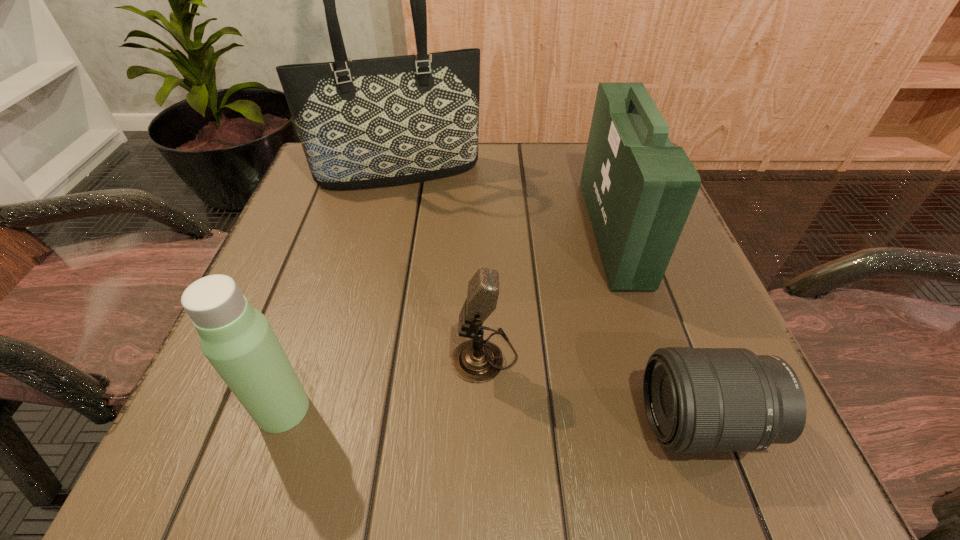
Locate an element on the screen. tote bag that is at the left edge is located at coordinates (375, 122).

Locate an element on the screen. Image resolution: width=960 pixels, height=540 pixels. thermos bottle located at the left edge is located at coordinates (237, 339).

What are the coordinates of `the first-aid kit that is at the right edge` in the screenshot? It's located at (639, 189).

Locate an element on the screen. The image size is (960, 540). telephoto lens positioned at the right edge is located at coordinates (697, 400).

Locate an element on the screen. The image size is (960, 540). object that is at the far left corner is located at coordinates (375, 122).

The width and height of the screenshot is (960, 540). Find the location of `object that is at the near left corner`. object that is at the near left corner is located at coordinates (237, 339).

The image size is (960, 540). Identify the location of object that is at the far right corner. (639, 189).

I want to click on object that is at the near right corner, so coord(697,400).

At what (x,y) coordinates should I click in order to perform the action: click on vacant region at the far edge of the desktop. Please return your answer as a coordinate pair (x, y). The height and width of the screenshot is (540, 960). Looking at the image, I should click on (488, 150).

At what (x,y) coordinates should I click in order to perform the action: click on free space at the near edge of the desktop. Please return your answer as a coordinate pair (x, y). Image resolution: width=960 pixels, height=540 pixels. Looking at the image, I should click on (x=482, y=423).